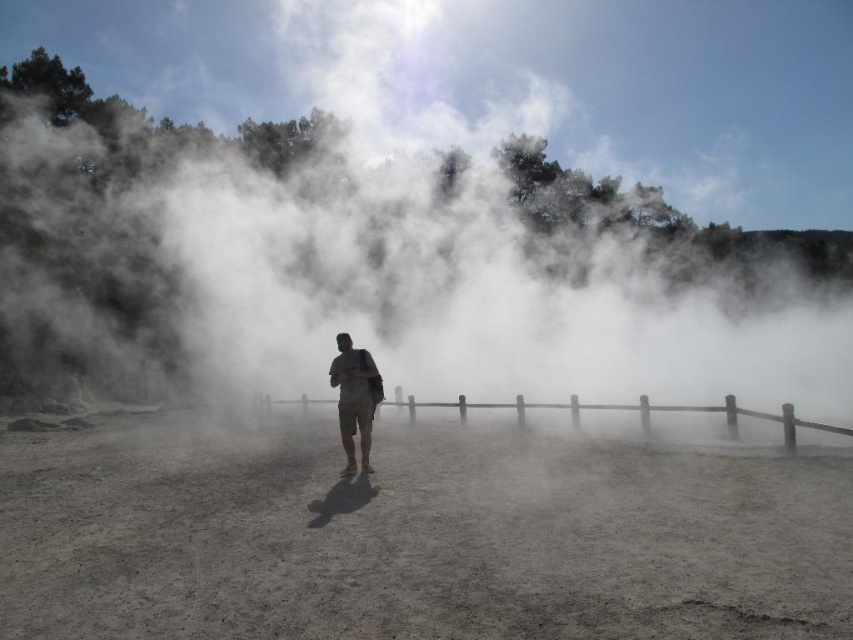
How far apart are brown wooden fence at center and tan cotton shorts at center?

brown wooden fence at center is 5.30 meters from tan cotton shorts at center.

Is point (793, 436) positioned in front of point (349, 392)?

No.

Who is more distant from viewer, (845, 432) or (350, 344)?

The point (350, 344) is more distant.

Where is `brown wooden fence at center`? The width and height of the screenshot is (853, 640). brown wooden fence at center is located at coordinates (637, 413).